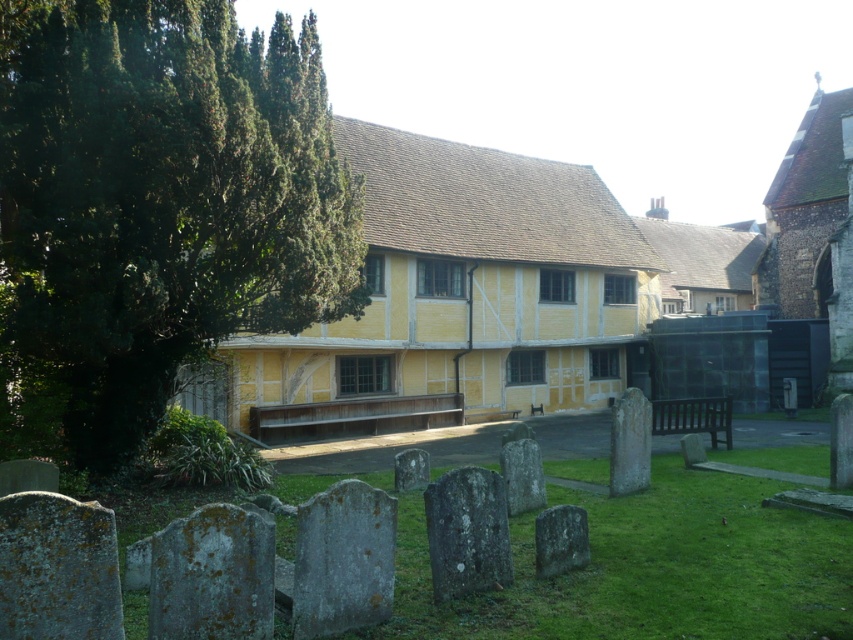
Question: Is green leafy tree at left thinner than smooth gray stone at lower center?

Choices:
 (A) no
 (B) yes

Answer: (A)

Question: Which of the following is the farthest from the observer?

Choices:
 (A) (451, 492)
 (B) (572, 554)

Answer: (B)

Question: Is green leafy tree at left to the right of gray stone gravestone at center from the viewer's perspective?

Choices:
 (A) yes
 (B) no

Answer: (B)

Question: Estimate the real-world distances between objects in this image. Which object is farther from the yellow timber-framed building at center?

Choices:
 (A) smooth gray stone at lower center
 (B) green leafy tree at left

Answer: (A)

Question: Does green leafy tree at left have a smaller size compared to smooth gray stone at lower center?

Choices:
 (A) yes
 (B) no

Answer: (B)

Question: Which object is the closest to the green leafy tree at left?

Choices:
 (A) yellow timber-framed building at center
 (B) gray stone gravestone at center

Answer: (B)